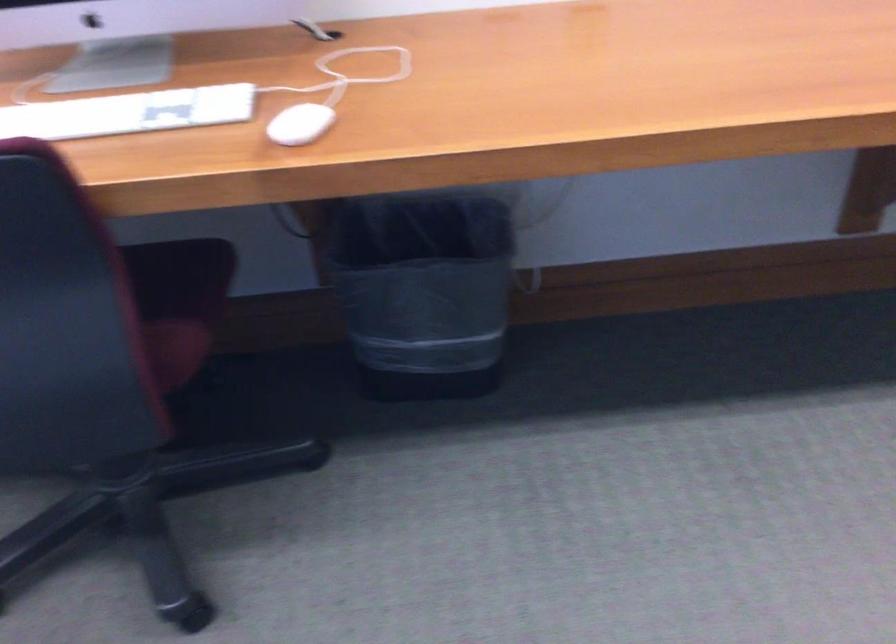
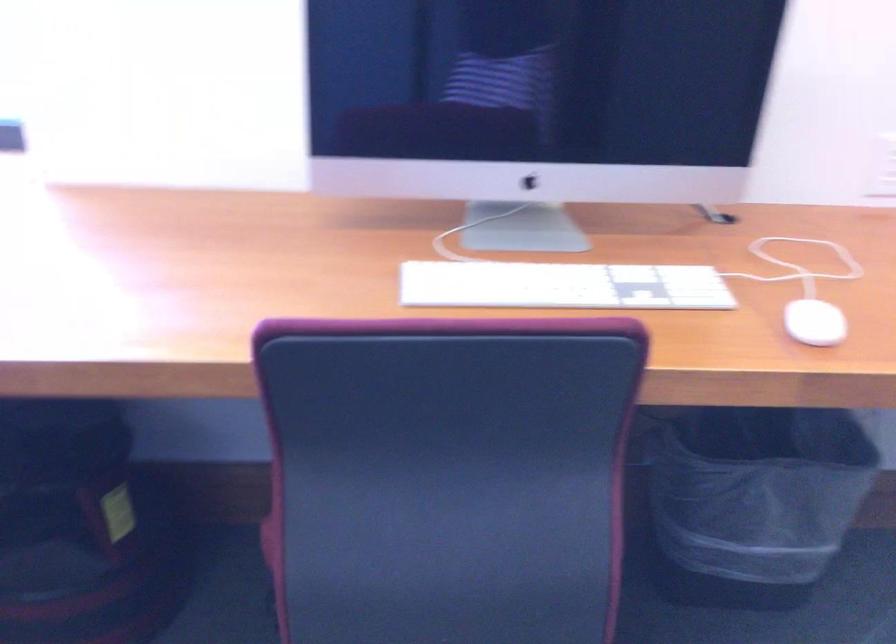
Find the pixel in the second image that matches (399,299) in the first image.

(753, 500)